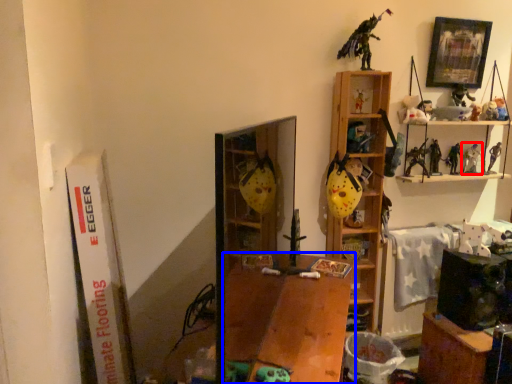
Question: Which object appears closest to the camera in this image, toy (highlighted by a red box) or table (highlighted by a blue box)?

Choices:
 (A) toy
 (B) table

Answer: (B)